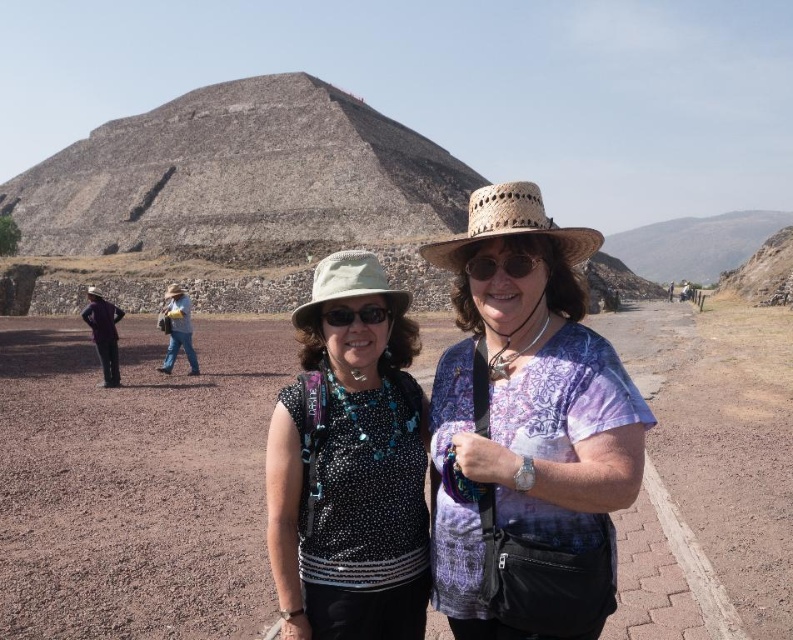
Question: Is matte brown sunglasses at center further to camera compared to matte black sunglasses at center?

Choices:
 (A) yes
 (B) no

Answer: (B)

Question: Observing the image, what is the correct spatial positioning of denim jeans at center in reference to matte brown sunglasses at center?

Choices:
 (A) below
 (B) above

Answer: (A)

Question: Does polka dot fabric shirt at center appear under dark brown leather jacket at left?

Choices:
 (A) no
 (B) yes

Answer: (B)

Question: Which of the following is the closest to the observer?

Choices:
 (A) denim jeans at center
 (B) printed cotton shirt at center
 (C) dark brown leather jacket at left
 (D) polka dot fabric shirt at center

Answer: (B)

Question: Which object is positioned farthest from the matte brown sunglasses at center?

Choices:
 (A) printed cotton shirt at center
 (B) dark brown leather jacket at left

Answer: (B)

Question: Among these points, which one is nearest to the camera?

Choices:
 (A) (94, 301)
 (B) (385, 280)

Answer: (B)